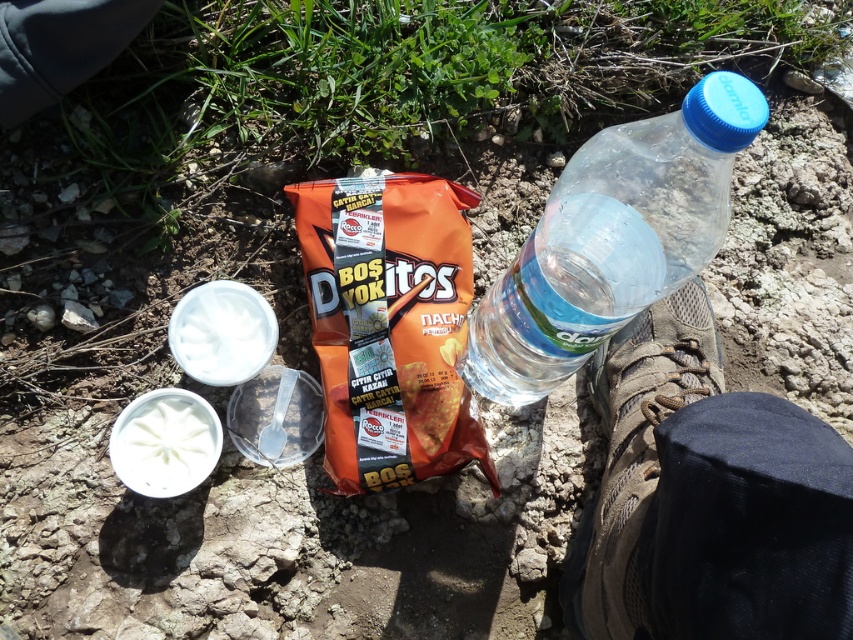
Question: Which point is farther to the camera?

Choices:
 (A) transparent plastic bottle at right
 (B) orange matte doritos at center

Answer: (B)

Question: Which object is farther from the camera taking this photo?

Choices:
 (A) orange matte doritos at center
 (B) transparent plastic bottle at right

Answer: (A)

Question: Does orange matte doritos at center lie behind transparent plastic bottle at right?

Choices:
 (A) yes
 (B) no

Answer: (A)

Question: Among these points, which one is nearest to the camera?

Choices:
 (A) 451,243
 (B) 466,362

Answer: (A)

Question: Can you confirm if orange matte doritos at center is positioned below transparent plastic bottle at right?

Choices:
 (A) yes
 (B) no

Answer: (A)

Question: Can you confirm if orange matte doritos at center is wider than transparent plastic bottle at right?

Choices:
 (A) no
 (B) yes

Answer: (B)